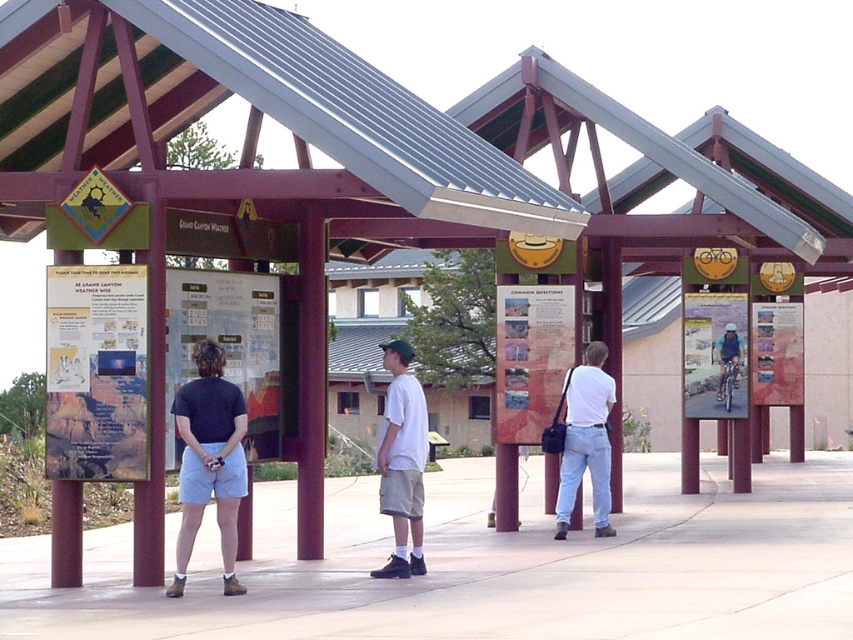
Does dark blue t-shirt at center lie behind white cotton shirt at center?

That is False.

Does dark blue t-shirt at center come in front of white cotton shirt at center?

Yes, dark blue t-shirt at center is closer to the viewer.

Is point (206, 454) behind point (395, 547)?

No, (206, 454) is in front of (395, 547).

Locate an element on the screen. dark blue t-shirt at center is located at coordinates (209, 460).

Between light blue denim shorts at center and dark blue t-shirt at center, which one is positioned lower?

Positioned lower is light blue denim shorts at center.

Where is `light blue denim shorts at center`? This screenshot has height=640, width=853. light blue denim shorts at center is located at coordinates (x=402, y=464).

Is dark blue t-shirt at center positioned at the back of white matte shirt at center?

No, dark blue t-shirt at center is closer to the viewer.

Can you confirm if dark blue t-shirt at center is taller than white matte shirt at center?

Incorrect, dark blue t-shirt at center's height is not larger of white matte shirt at center's.

This screenshot has width=853, height=640. In order to click on dark blue t-shirt at center in this screenshot , I will do `click(209, 460)`.

Where is `dark blue t-shirt at center`? dark blue t-shirt at center is located at coordinates point(209,460).